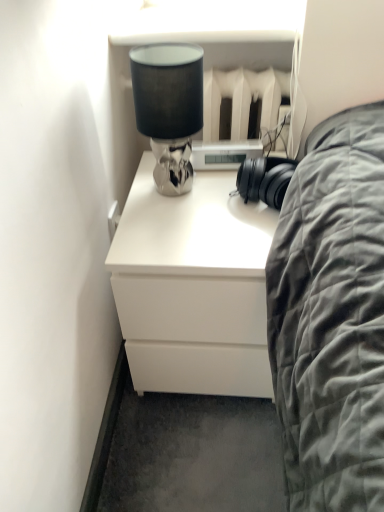
Question: Should I look upward or downward to see satin silver lamp at upper center?

Choices:
 (A) up
 (B) down

Answer: (A)

Question: Can you confirm if white matte chest of drawers at center is wider than satin silver lamp at upper center?

Choices:
 (A) no
 (B) yes

Answer: (B)

Question: Is white matte chest of drawers at center to the right of satin silver lamp at upper center from the viewer's perspective?

Choices:
 (A) no
 (B) yes

Answer: (B)

Question: Considering the relative sizes of white matte chest of drawers at center and satin silver lamp at upper center in the image provided, is white matte chest of drawers at center smaller than satin silver lamp at upper center?

Choices:
 (A) yes
 (B) no

Answer: (B)

Question: From a real-world perspective, is white matte chest of drawers at center physically below satin silver lamp at upper center?

Choices:
 (A) yes
 (B) no

Answer: (A)

Question: Considering the relative sizes of white matte chest of drawers at center and satin silver lamp at upper center in the image provided, is white matte chest of drawers at center bigger than satin silver lamp at upper center?

Choices:
 (A) yes
 (B) no

Answer: (A)

Question: Is the position of white matte chest of drawers at center more distant than that of satin silver lamp at upper center?

Choices:
 (A) yes
 (B) no

Answer: (A)

Question: Is satin silver lamp at upper center outside white matte chest of drawers at center?

Choices:
 (A) no
 (B) yes

Answer: (B)

Question: Is satin silver lamp at upper center wider than white matte chest of drawers at center?

Choices:
 (A) yes
 (B) no

Answer: (B)

Question: From the image's perspective, is satin silver lamp at upper center above white matte chest of drawers at center?

Choices:
 (A) yes
 (B) no

Answer: (A)

Question: Is satin silver lamp at upper center next to white matte chest of drawers at center and touching it?

Choices:
 (A) no
 (B) yes

Answer: (A)

Question: Is satin silver lamp at upper center shorter than white matte chest of drawers at center?

Choices:
 (A) yes
 (B) no

Answer: (A)

Question: Is satin silver lamp at upper center at the right side of white matte chest of drawers at center?

Choices:
 (A) no
 (B) yes

Answer: (A)

Question: Is satin silver lamp at upper center wider or thinner than white matte chest of drawers at center?

Choices:
 (A) thin
 (B) wide

Answer: (A)